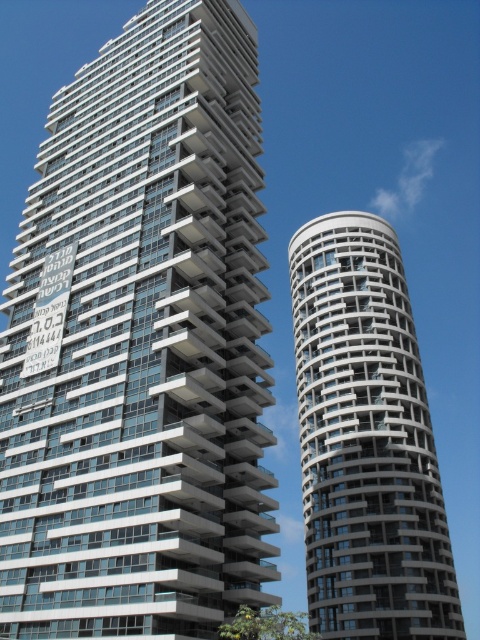
Question: Among these points, which one is nearest to the camera?

Choices:
 (A) (251, 104)
 (B) (363, 588)

Answer: (A)

Question: Which object appears farthest from the camera in this image?

Choices:
 (A) matte glass building at center
 (B) white textured building at right

Answer: (B)

Question: Considering the relative positions of matte glass building at center and white textured building at right in the image provided, where is matte glass building at center located with respect to white textured building at right?

Choices:
 (A) above
 (B) below

Answer: (A)

Question: Can you confirm if matte glass building at center is positioned to the right of white textured building at right?

Choices:
 (A) no
 (B) yes

Answer: (A)

Question: Which object is farther from the camera taking this photo?

Choices:
 (A) matte glass building at center
 (B) white textured building at right

Answer: (B)

Question: Is matte glass building at center further to the viewer compared to white textured building at right?

Choices:
 (A) no
 (B) yes

Answer: (A)